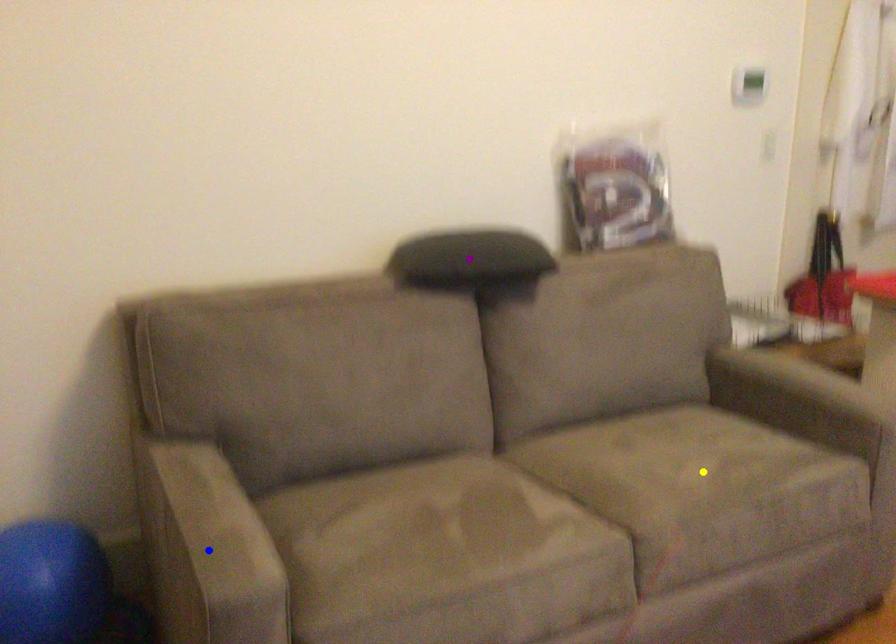
Order these from nearest to farthest:
purple point, blue point, yellow point

1. purple point
2. yellow point
3. blue point